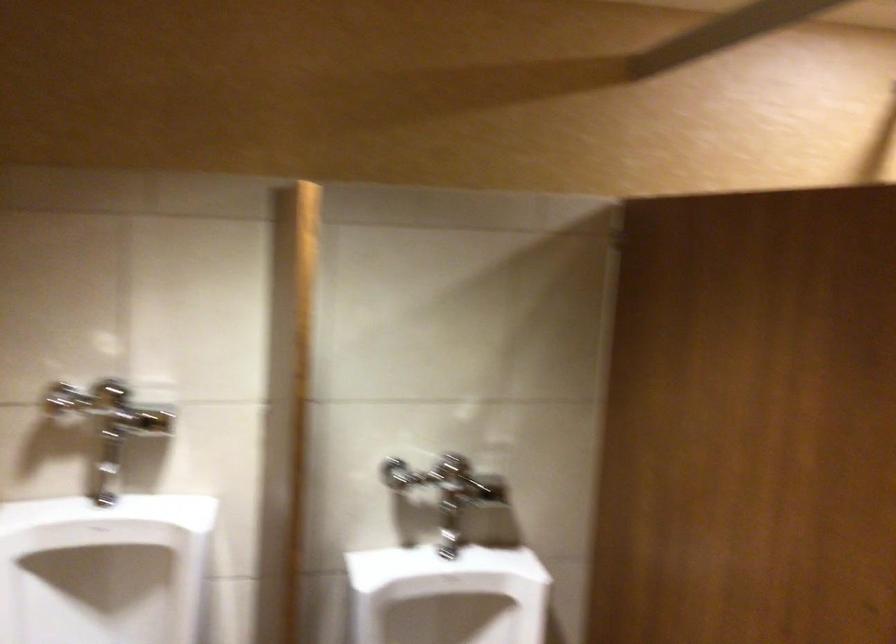
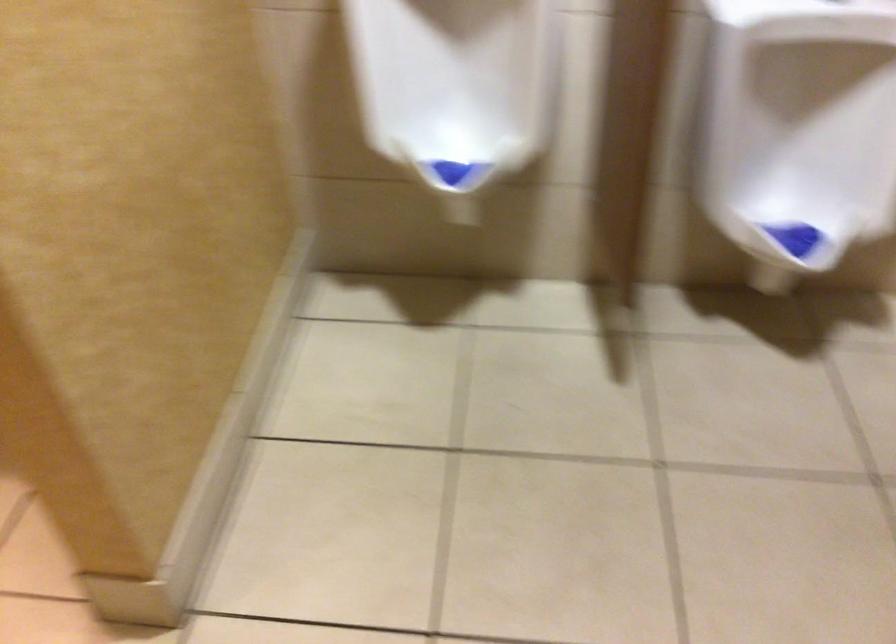
First-person continuous shooting, in which direction is the camera rotating?

The camera rotated toward left-down.